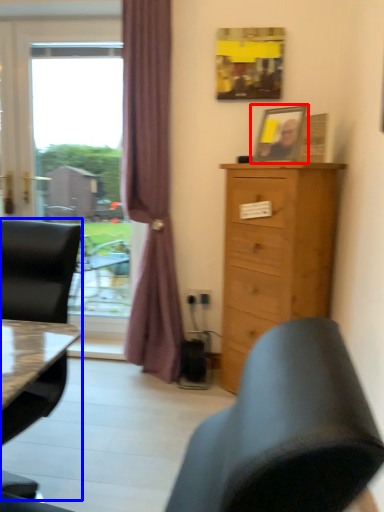
Question: Which object appears closest to the camera in this image, picture frame (highlighted by a red box) or chair (highlighted by a blue box)?

Choices:
 (A) picture frame
 (B) chair

Answer: (B)